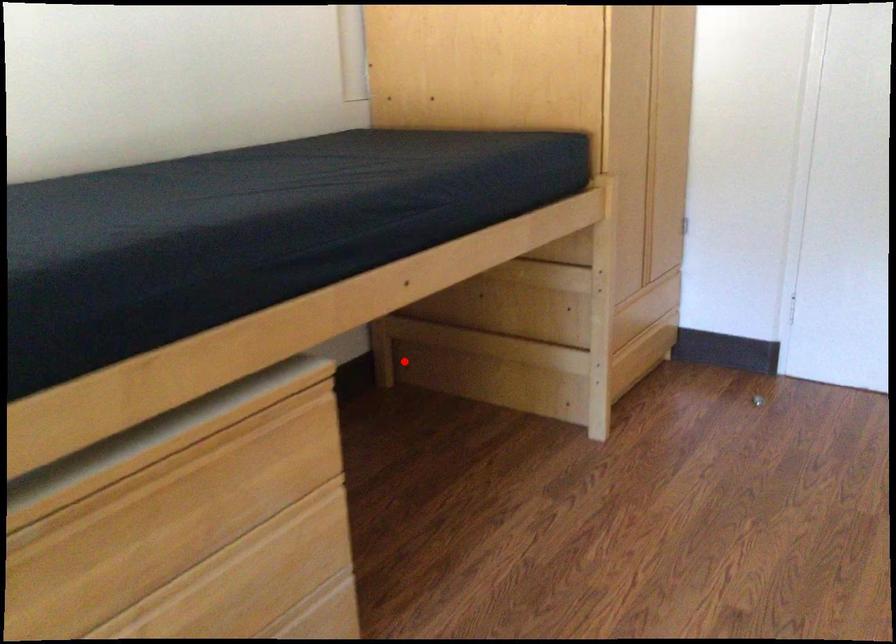
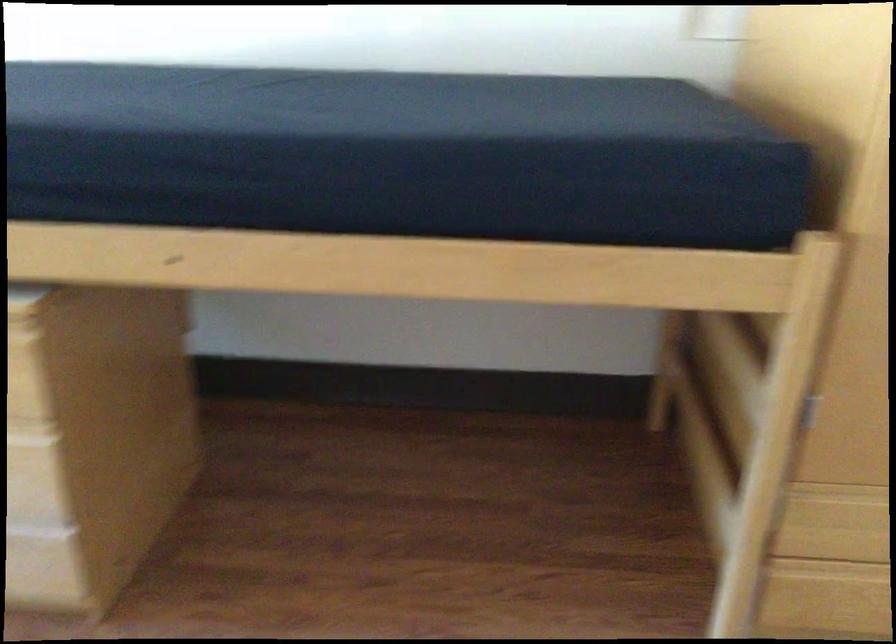
Question: I am providing you with two images of the same scene from different viewpoints. In image1, a red point is highlighted. Considering the same 3D point in image2, which of the following is correct?

Choices:
 (A) It is closer
 (B) It is farther

Answer: (A)